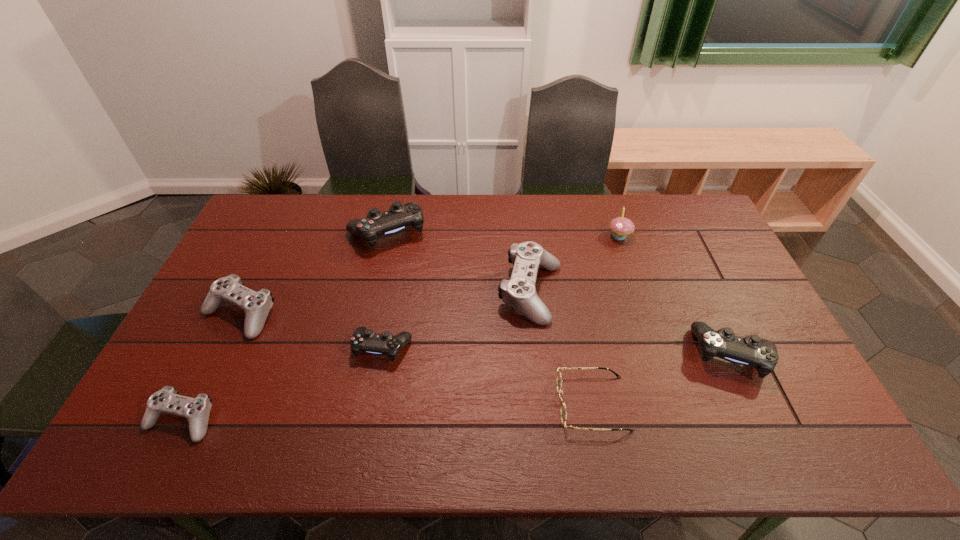
I want to click on vacant region located on the lenses of the spectacles, so click(477, 403).

Locate an element on the screen. The height and width of the screenshot is (540, 960). free region located on the lenses of the spectacles is located at coordinates (421, 403).

I want to click on vacant space positioned on the right of the smallest white control, so click(x=313, y=419).

Locate an element on the screen. cupcake present at the far edge is located at coordinates (620, 226).

Image resolution: width=960 pixels, height=540 pixels. I want to click on control positioned at the far edge, so click(399, 217).

Identify the location of spectacles present at the near edge. Image resolution: width=960 pixels, height=540 pixels. [563, 412].

Locate an element on the screen. The image size is (960, 540). control located in the near edge section of the desktop is located at coordinates (197, 410).

You are a GUI agent. You are given a task and a screenshot of the screen. Output one action in this format:
    pyautogui.click(x=<x>, y=<y>)
    Task: Click on the object that is at the right edge
    Image resolution: width=960 pixels, height=540 pixels.
    Given the screenshot: What is the action you would take?
    pyautogui.click(x=752, y=351)

Locate an element on the screen. object at the near left corner is located at coordinates (197, 410).

Where is `free space at the far edge of the desktop`? free space at the far edge of the desktop is located at coordinates (317, 216).